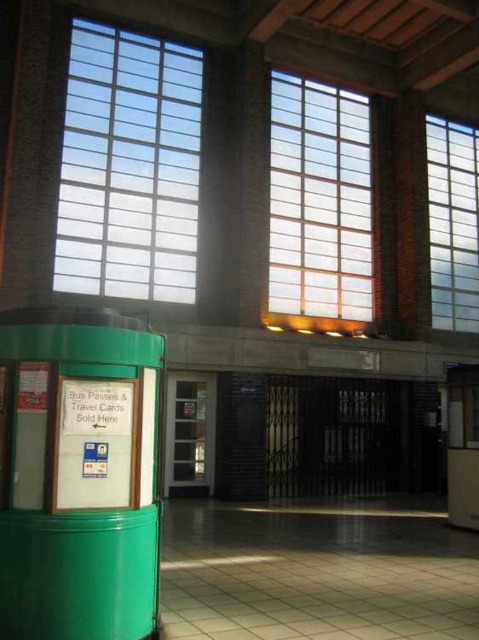
Question: Is the position of transparent glass window at upper left less distant than that of translucent glass window at center?

Choices:
 (A) yes
 (B) no

Answer: (A)

Question: Which of the following is the closest to the observer?

Choices:
 (A) clear glass window at upper right
 (B) translucent glass window at center

Answer: (B)

Question: In this image, where is transparent glass window at upper left located relative to clear glass window at upper right?

Choices:
 (A) above
 (B) below

Answer: (A)

Question: Considering the real-world distances, which object is closest to the translucent glass window at center?

Choices:
 (A) green matte phone box at lower left
 (B) transparent glass window at upper left

Answer: (B)

Question: Estimate the real-world distances between objects in this image. Which object is farther from the translucent glass window at center?

Choices:
 (A) clear glass window at upper right
 (B) green matte phone box at lower left

Answer: (B)

Question: Can you confirm if green matte phone box at lower left is bigger than translucent glass window at center?

Choices:
 (A) yes
 (B) no

Answer: (B)